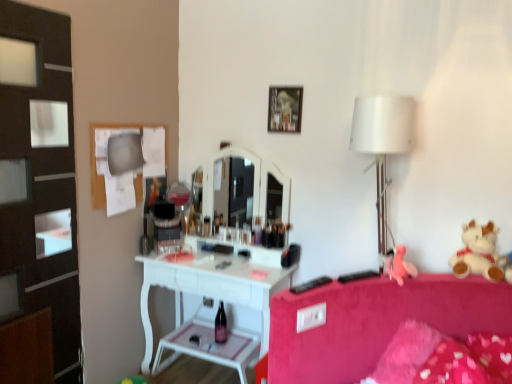
What do you see at coordinates (382, 143) in the screenshot?
I see `white fabric lampshade at right` at bounding box center [382, 143].

The width and height of the screenshot is (512, 384). What are the coordinates of `white fabric lampshade at right` in the screenshot? It's located at (382, 143).

This screenshot has width=512, height=384. Find the location of `pink fabric teddy bear at right`. pink fabric teddy bear at right is located at coordinates (399, 265).

Image resolution: width=512 pixels, height=384 pixels. What do you see at coordinates (399, 265) in the screenshot? I see `pink fabric teddy bear at right` at bounding box center [399, 265].

Image resolution: width=512 pixels, height=384 pixels. What do you see at coordinates (443, 358) in the screenshot?
I see `fluffy pink pillow at lower right` at bounding box center [443, 358].

What is the approximate height of fluffy pink pillow at lower right?

It is 10.88 inches.

Describe the element at coordinates (478, 253) in the screenshot. This screenshot has height=384, width=512. I see `white plush teddy bear at right` at that location.

Identify the location of matte glass bottle at center. (220, 325).

Does white fabric lampshade at right have a lesser width compared to pink fabric teddy bear at right?

No.

Which of these two, white fabric lampshade at right or pink fabric teddy bear at right, is smaller?

With smaller size is pink fabric teddy bear at right.

How different are the orientations of white fabric lampshade at right and pink fabric teddy bear at right in degrees?

There is a 49-degree angle between the facing directions of white fabric lampshade at right and pink fabric teddy bear at right.

From the image's perspective, is white fabric lampshade at right under pink fabric teddy bear at right?

No, from the image's perspective, white fabric lampshade at right is not below pink fabric teddy bear at right.

From the image's perspective, is matte glass bottle at center on top of white fabric lampshade at right?

No, from the image's perspective, matte glass bottle at center is not above white fabric lampshade at right.

Which of these two, matte glass bottle at center or white fabric lampshade at right, is smaller?

matte glass bottle at center is smaller.

Between matte glass bottle at center and white fabric lampshade at right, which one appears on the left side from the viewer's perspective?

From the viewer's perspective, matte glass bottle at center appears more on the left side.

Is matte glass bottle at center in front of or behind white fabric lampshade at right in the image?

Visually, matte glass bottle at center is located behind white fabric lampshade at right.

Is wooden picture frame at upper center placed right next to pink fabric teddy bear at right?

wooden picture frame at upper center and pink fabric teddy bear at right are clearly separated.

From a real-world perspective, who is located lower, wooden picture frame at upper center or pink fabric teddy bear at right?

pink fabric teddy bear at right.

Between point (301, 87) and point (394, 272), which one is positioned in front?

The point (394, 272) is more forward.

Is wooden picture frame at upper center not within pink fabric teddy bear at right?

Yes, wooden picture frame at upper center is not within pink fabric teddy bear at right.

Is the depth of white plush teddy bear at right less than that of wooden picture frame at upper center?

Yes, white plush teddy bear at right is in front of wooden picture frame at upper center.

Choose the correct answer: Is white plush teddy bear at right inside wooden picture frame at upper center or outside it?

white plush teddy bear at right is located beyond the bounds of wooden picture frame at upper center.

From a real-world perspective, is white plush teddy bear at right physically located above or below wooden picture frame at upper center?

white plush teddy bear at right is below wooden picture frame at upper center.

Is white plush teddy bear at right taller than wooden picture frame at upper center?

Incorrect, the height of white plush teddy bear at right is not larger of that of wooden picture frame at upper center.

Consider the image. How many degrees apart are the facing directions of white fabric lampshade at right and white plush teddy bear at right?

They differ by 4.64 degrees in their facing directions.

Is white plush teddy bear at right a part of white fabric lampshade at right?

No.

Does white fabric lampshade at right have a greater height compared to white plush teddy bear at right?

Correct, white fabric lampshade at right is much taller as white plush teddy bear at right.

From a real-world perspective, which is physically below, white fabric lampshade at right or white plush teddy bear at right?

In real-world perspective, white plush teddy bear at right is lower.

Is wooden picture frame at upper center in front of or behind matte glass bottle at center in the image?

Visually, wooden picture frame at upper center is located in front of matte glass bottle at center.

Which is correct: wooden picture frame at upper center is inside matte glass bottle at center, or outside of it?

wooden picture frame at upper center is located beyond the bounds of matte glass bottle at center.

Is point (291, 96) closer or farther from the camera than point (217, 321)?

Clearly, point (291, 96) is closer to the camera than point (217, 321).

Visually, is wooden picture frame at upper center positioned to the left or to the right of matte glass bottle at center?

In the image, wooden picture frame at upper center appears on the right side of matte glass bottle at center.

How different are the orientations of black plastic remote control at lower center, which is counted as the second remote control, starting from the right, and wooden picture frame at upper center in degrees?

22.2 degrees.

From a real-world perspective, is black plastic remote control at lower center, which is counted as the second remote control, starting from the right, located higher than wooden picture frame at upper center?

No, from a real-world perspective, black plastic remote control at lower center, which is counted as the second remote control, starting from the right, is not over wooden picture frame at upper center

Could you tell me if black plastic remote control at lower center, which is counted as the 1th remote control, starting from the left, is facing wooden picture frame at upper center?

No, black plastic remote control at lower center, which is counted as the 1th remote control, starting from the left, is not aimed at wooden picture frame at upper center.

Does point (321, 279) come closer to viewer compared to point (290, 90)?

Yes, point (321, 279) is closer to viewer.

The height and width of the screenshot is (384, 512). I want to click on toy below the white fabric lampshade at right (from the image's perspective), so click(x=399, y=265).

You are a GUI agent. You are given a task and a screenshot of the screen. Output one action in this format:
    pyautogui.click(x=<x>, y=<y>)
    Task: Click on the bottle behind the white fabric lampshade at right
    The height and width of the screenshot is (384, 512).
    Given the screenshot: What is the action you would take?
    pyautogui.click(x=220, y=325)

Estimate the real-world distances between objects in this image. Which object is further from wooden picture frame at upper center, matte glass bottle at center or white plush teddy bear at right?

Based on the image, matte glass bottle at center appears to be further to wooden picture frame at upper center.

Which object lies nearer to the anchor point black plastic remote control at lower center, which is counted as the second remote control, starting from the right, fluffy pink pillow at lower right or matte glass bottle at center?

fluffy pink pillow at lower right lies closer to black plastic remote control at lower center, which is counted as the second remote control, starting from the right, than the other object.

Based on their spatial positions, is white fabric lampshade at right or white plush teddy bear at right closer to fluffy pink pillow at lower right?

white plush teddy bear at right lies closer to fluffy pink pillow at lower right than the other object.

Looking at the image, which one is located closer to pink fabric teddy bear at right, white fabric lampshade at right or white plush teddy bear at right?

white plush teddy bear at right is positioned closer to the anchor pink fabric teddy bear at right.

Looking at the image, which one is located further to pink fabric teddy bear at right, wooden picture frame at upper center or black plastic remote control at lower center, which is counted as the second remote control, starting from the right?

wooden picture frame at upper center is further to pink fabric teddy bear at right.

Estimate the real-world distances between objects in this image. Which object is further from wooden picture frame at upper center, fluffy pink pillow at lower right or white plush teddy bear at right?

Among the two, fluffy pink pillow at lower right is located further to wooden picture frame at upper center.

From the image, which object appears to be farther from pink fabric teddy bear at right, black plastic remote control at lower right, positioned as the second remote control in left-to-right order, or white fabric lampshade at right?

white fabric lampshade at right.

Looking at the image, which one is located closer to fluffy pink pillow at lower right, black plastic remote control at lower center, which is counted as the second remote control, starting from the right, or wooden picture frame at upper center?

black plastic remote control at lower center, which is counted as the second remote control, starting from the right, lies closer to fluffy pink pillow at lower right than the other object.

Locate an element on the screen. The width and height of the screenshot is (512, 384). remote control between black plastic remote control at lower center, which is counted as the second remote control, starting from the right, and white plush teddy bear at right from left to right is located at coordinates (358, 276).

I want to click on toy between white fabric lampshade at right and fluffy pink pillow at lower right vertically, so click(x=399, y=265).

I want to click on lamp between wooden picture frame at upper center and matte glass bottle at center from top to bottom, so click(382, 143).

This screenshot has height=384, width=512. Identify the location of teddy bear between wooden picture frame at upper center and black plastic remote control at lower right, positioned as the second remote control in left-to-right order, in the up-down direction. (478, 253).